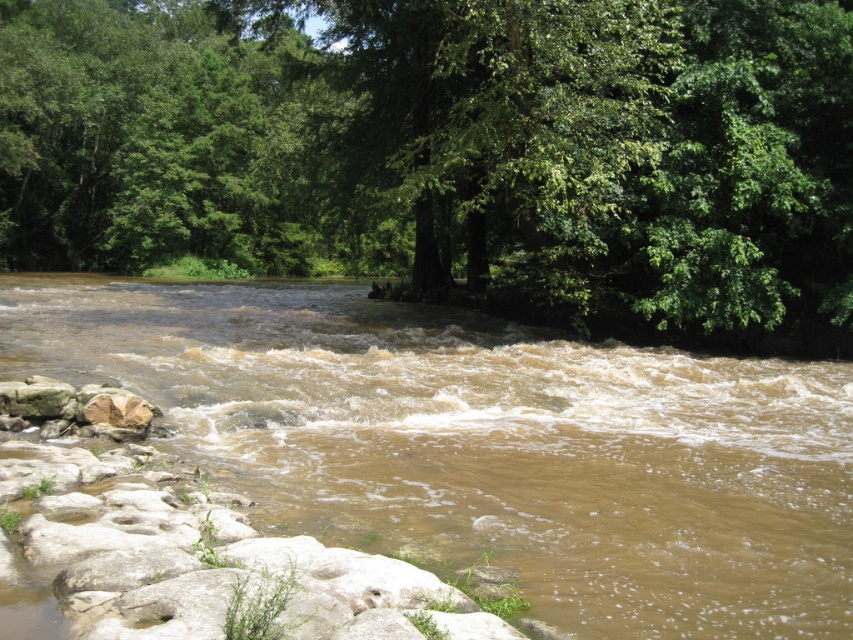
Question: Does brown muddy water at center appear on the right side of gray rock at lower left?

Choices:
 (A) no
 (B) yes

Answer: (B)

Question: Which point is closer to the camera taking this photo?

Choices:
 (A) (102, 397)
 (B) (672, 467)
 (C) (32, 417)

Answer: (B)

Question: Is brown muddy water at center positioned at the back of brown rough rock at lower left?

Choices:
 (A) no
 (B) yes

Answer: (A)

Question: Which point is closer to the camera?

Choices:
 (A) brown rough rock at lower left
 (B) brown muddy water at center

Answer: (B)

Question: Estimate the real-world distances between objects in this image. Which object is closer to the brown muddy water at center?

Choices:
 (A) gray rock at lower left
 (B) green leafy tree at upper center

Answer: (A)

Question: Can you confirm if brown muddy water at center is wider than brown rough rock at lower left?

Choices:
 (A) no
 (B) yes

Answer: (B)